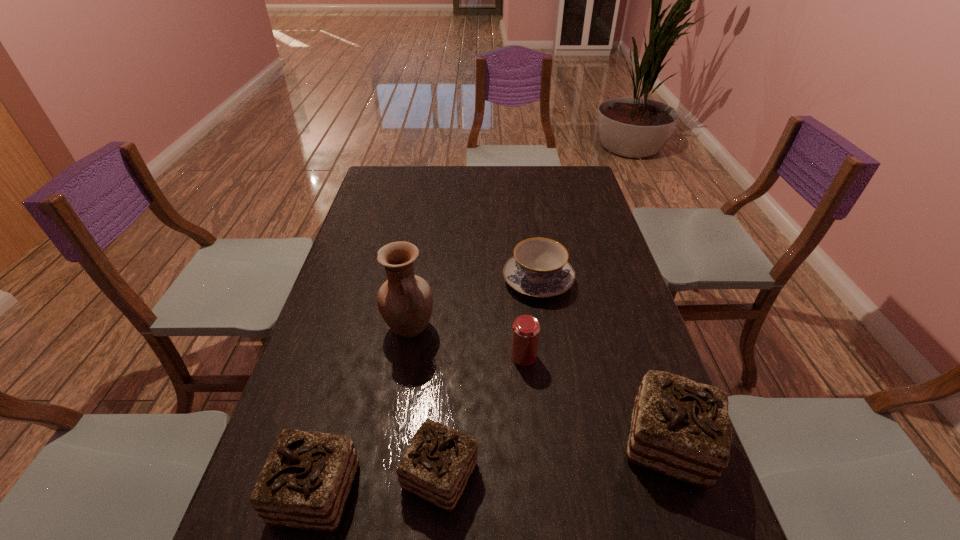
Image resolution: width=960 pixels, height=540 pixels. In order to click on free space between the rightmost chocolate cake and the tallest object in this screenshot , I will do `click(539, 386)`.

This screenshot has height=540, width=960. Identify the location of unoccupied position between the second tallest chocolate cake and the rightmost object. (492, 468).

Locate an element on the screen. This screenshot has width=960, height=540. empty location between the second tallest chocolate cake and the farthest object is located at coordinates (427, 386).

Select which object appears as the second closest to the tallest object. Please provide its 2D coordinates. Your answer should be formatted as a tuple, i.e. [(x, y)], where the tuple contains the x and y coordinates of a point satisfying the conditions above.

[(525, 335)]

Select which object is the fifth closest to the farthest object. Please provide its 2D coordinates. Your answer should be formatted as a tuple, i.e. [(x, y)], where the tuple contains the x and y coordinates of a point satisfying the conditions above.

[(305, 483)]

Point out which chocolate cake is positioned as the second nearest to the rightmost object. Please provide its 2D coordinates. Your answer should be formatted as a tuple, i.e. [(x, y)], where the tuple contains the x and y coordinates of a point satisfying the conditions above.

[(305, 483)]

Locate an element on the screen. chocolate cake object that ranks as the closest to the beer can is located at coordinates (680, 428).

Identify the location of free location that satisfies the following two spatial constraints: 1. on the front side of the beer can; 2. on the left side of the rightmost chocolate cake. The width and height of the screenshot is (960, 540). (532, 443).

Find the location of a particular element. free spot that satisfies the following two spatial constraints: 1. on the back side of the beer can; 2. on the left side of the shortest chocolate cake is located at coordinates (448, 356).